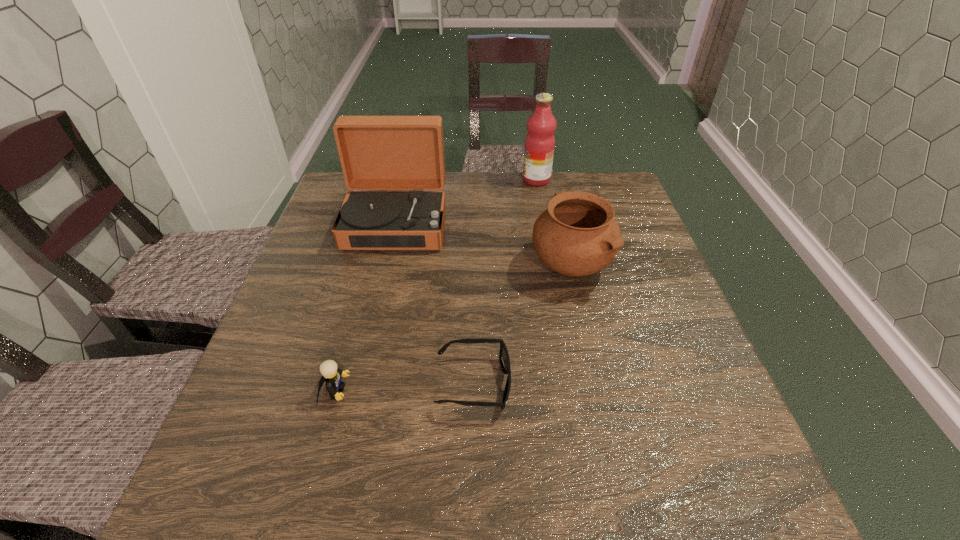
Where is `free spot at the near edge of the desktop`? This screenshot has width=960, height=540. free spot at the near edge of the desktop is located at coordinates pos(421,524).

Image resolution: width=960 pixels, height=540 pixels. In the image, there is a desktop. Find the location of `vacant space at the right edge`. vacant space at the right edge is located at coordinates (645, 257).

Find the location of a particular element. vacant area at the far left corner is located at coordinates (331, 193).

This screenshot has width=960, height=540. In order to click on vacant space at the near left corner of the desktop in this screenshot , I will do `click(264, 472)`.

I want to click on free space at the far right corner of the desktop, so click(x=613, y=193).

Identify the location of free area in between the Lego and the third tallest object. This screenshot has width=960, height=540. (452, 328).

Find the location of `vacant space that's between the shortest object and the pottery`. vacant space that's between the shortest object and the pottery is located at coordinates (521, 324).

This screenshot has width=960, height=540. What are the coordinates of `empty space between the third tallest object and the second shortest object` in the screenshot? It's located at (452, 328).

Locate an element on the screen. This screenshot has height=540, width=960. free area in between the Lego and the sunglasses is located at coordinates (404, 388).

What are the coordinates of `vacant area that lies between the third object from right to left and the phonograph record` in the screenshot? It's located at (435, 304).